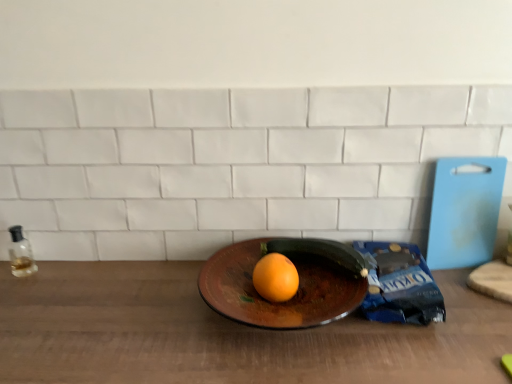
Question: Considering the relative sizes of transparent glass bottle at left and orange matte at center in the image provided, is transparent glass bottle at left wider than orange matte at center?

Choices:
 (A) yes
 (B) no

Answer: (B)

Question: From the image's perspective, is transparent glass bottle at left located above orange matte at center?

Choices:
 (A) no
 (B) yes

Answer: (B)

Question: Is transparent glass bottle at left looking in the opposite direction of orange matte at center?

Choices:
 (A) no
 (B) yes

Answer: (A)

Question: Can you confirm if transparent glass bottle at left is thinner than orange matte at center?

Choices:
 (A) yes
 (B) no

Answer: (A)

Question: Considering the relative sizes of transparent glass bottle at left and orange matte at center in the image provided, is transparent glass bottle at left taller than orange matte at center?

Choices:
 (A) no
 (B) yes

Answer: (B)

Question: Is shiny brown plate at center spatially inside transparent glass bottle at left, or outside of it?

Choices:
 (A) outside
 (B) inside

Answer: (A)

Question: From a real-world perspective, is shiny brown plate at center positioned above or below transparent glass bottle at left?

Choices:
 (A) above
 (B) below

Answer: (B)

Question: In the image, is shiny brown plate at center positioned in front of or behind transparent glass bottle at left?

Choices:
 (A) behind
 (B) front

Answer: (B)

Question: In terms of height, does shiny brown plate at center look taller or shorter compared to transparent glass bottle at left?

Choices:
 (A) tall
 (B) short

Answer: (B)

Question: In terms of height, does green matte zucchini at center look taller or shorter compared to orange matte at center?

Choices:
 (A) tall
 (B) short

Answer: (B)

Question: Relative to orange matte at center, is green matte zucchini at center in front or behind?

Choices:
 (A) front
 (B) behind

Answer: (B)

Question: Is green matte zucchini at center bigger or smaller than orange matte at center?

Choices:
 (A) big
 (B) small

Answer: (A)

Question: Is green matte zucchini at center inside or outside of orange matte at center?

Choices:
 (A) outside
 (B) inside

Answer: (A)

Question: From a real-world perspective, is orange matte at center above or below transparent glass bottle at left?

Choices:
 (A) above
 (B) below

Answer: (A)

Question: Is orange matte at center in front of or behind transparent glass bottle at left in the image?

Choices:
 (A) behind
 (B) front

Answer: (B)